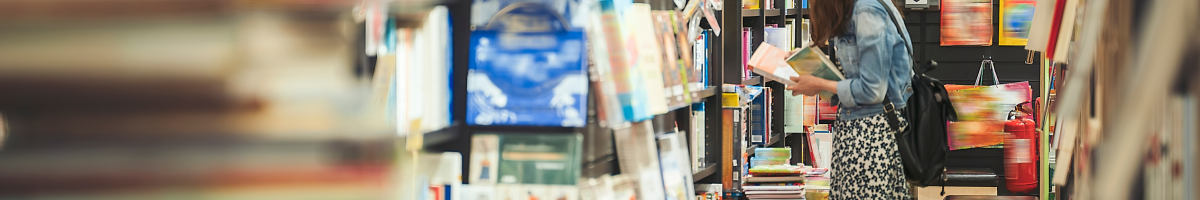
At what (x,y) coordinates should I click in order to perform the action: click on stack of books/papers. Please return your answer as a coordinate pair (x, y). Looking at the image, I should click on (119, 59).